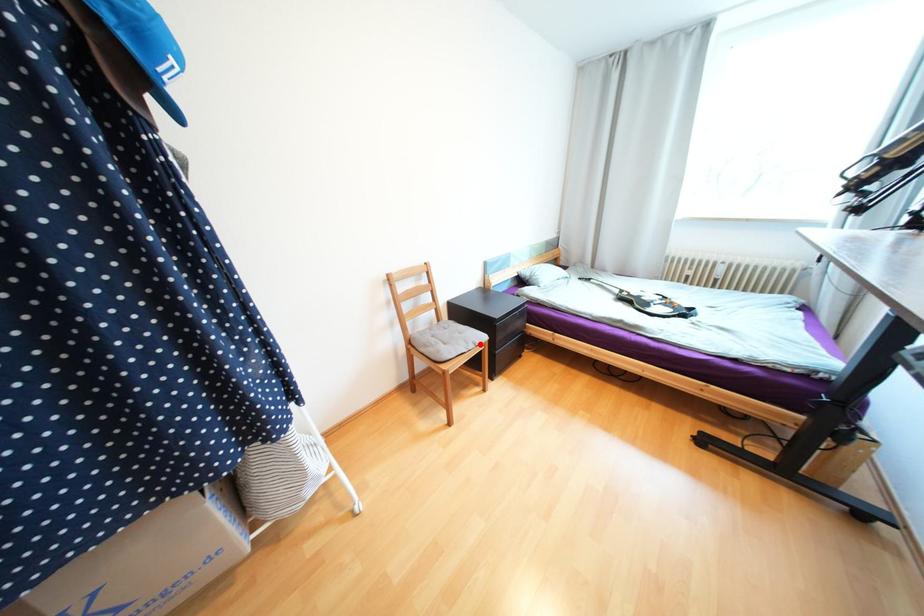
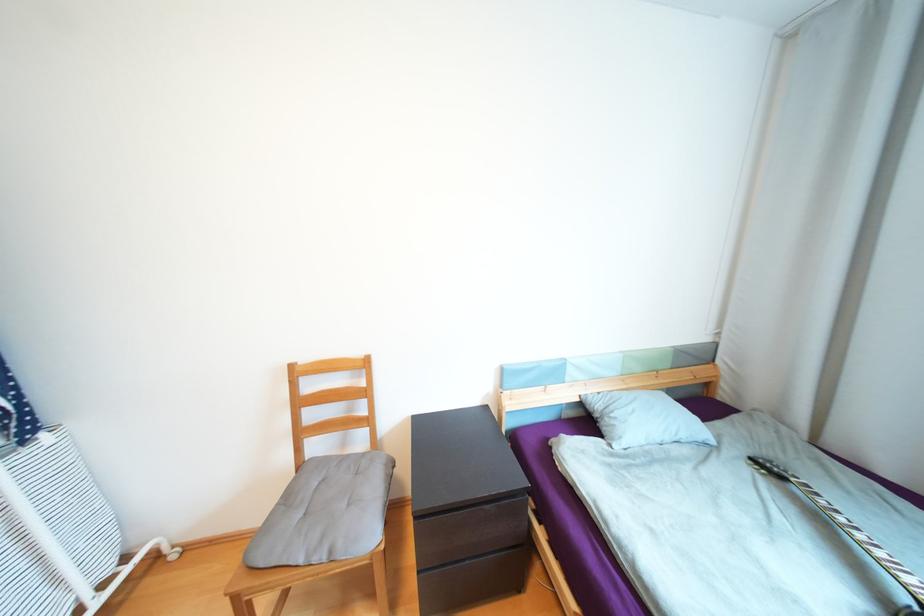
Question: I am providing you with two images of the same scene from different viewpoints. A red point is shown in image1. For the corresponding object point in image2, is it positioned nearer or farther from the camera?

Choices:
 (A) Nearer
 (B) Farther

Answer: (B)